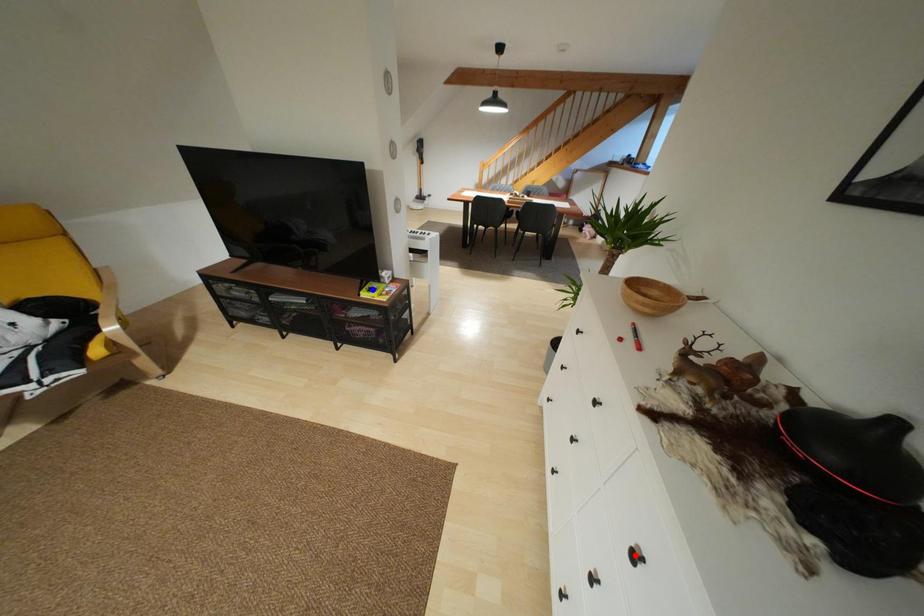
Question: In the image, two points are highlighted. Which point is nearer to the camera? Reply with the corresponding letter.

Choices:
 (A) blue point
 (B) red point

Answer: (B)